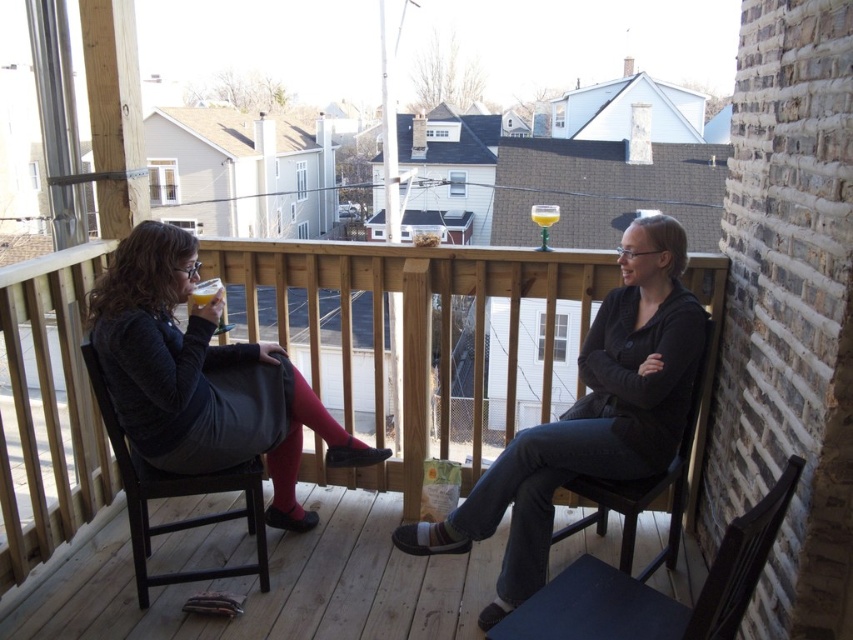
Which of these two, wooden deck at center or black wood chair at left, stands taller?

Standing taller between the two is wooden deck at center.

Which is in front, point (474, 259) or point (120, 440)?

Point (120, 440) is more forward.

Where is `wooden deck at center`? wooden deck at center is located at coordinates (409, 326).

Which is above, matte black jacket at center or black wood chair at lower right?

Positioned higher is matte black jacket at center.

Which is in front, point (688, 310) or point (758, 547)?

Point (758, 547) is more forward.

This screenshot has width=853, height=640. What do you see at coordinates (589, 417) in the screenshot?
I see `matte black jacket at center` at bounding box center [589, 417].

This screenshot has height=640, width=853. Identify the location of matte black jacket at center. (589, 417).

Is wooden deck at lower center in front of black wood chair at lower right?

That is False.

Does wooden deck at lower center appear on the left side of black wood chair at lower right?

Correct, you'll find wooden deck at lower center to the left of black wood chair at lower right.

Does point (380, 564) come in front of point (732, 636)?

No, it is behind (732, 636).

Find the location of a particular element. The height and width of the screenshot is (640, 853). wooden deck at lower center is located at coordinates (279, 588).